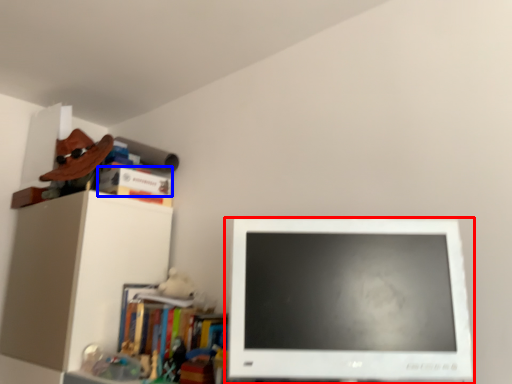
Question: Which object is further to the camera taking this photo, computer monitor (highlighted by a red box) or book (highlighted by a blue box)?

Choices:
 (A) computer monitor
 (B) book

Answer: (B)